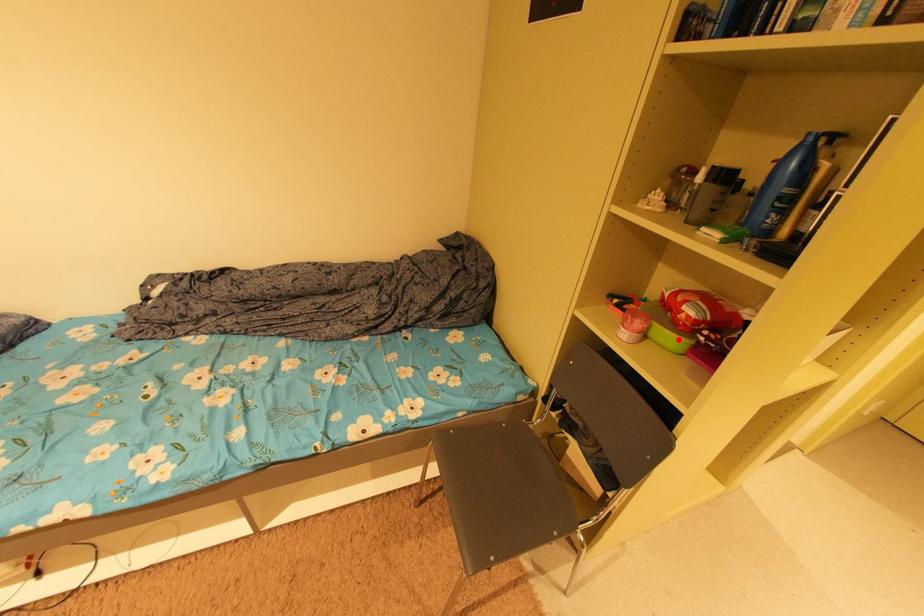
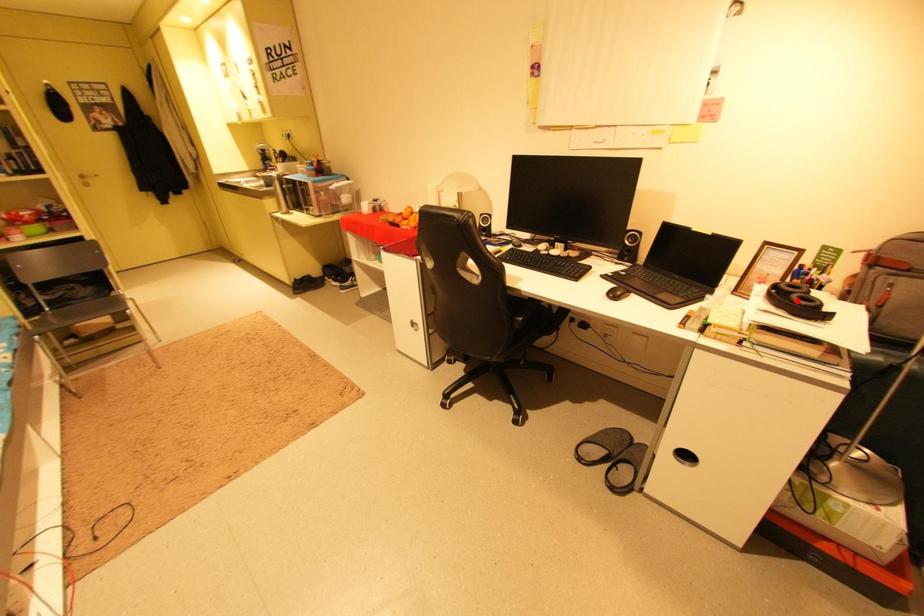
I am providing you with two images of the same scene from different viewpoints. A red point is marked on the first image and another point is marked on the second image. Are the points marked in image1 and image2 representing the same 3D position?

No